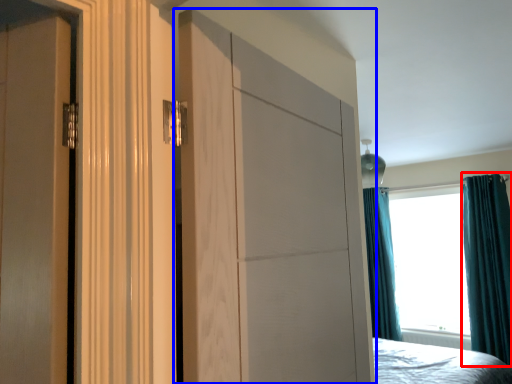
Question: Which object is further to the camera taking this photo, curtain (highlighted by a red box) or door (highlighted by a blue box)?

Choices:
 (A) curtain
 (B) door

Answer: (A)